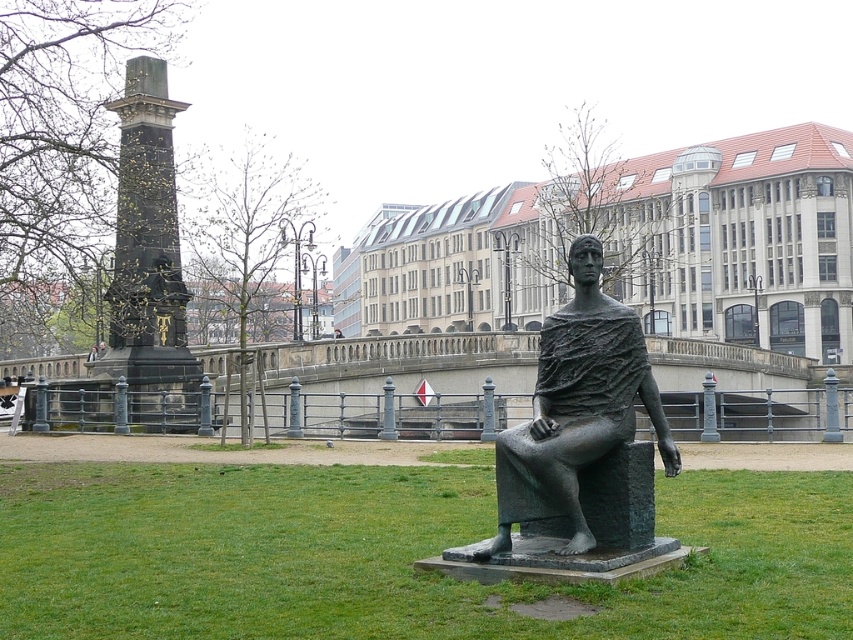
You are standing at the point with coordinates point [595,448] in the park. There is another point at point [171,538]. Which point is closer to you?

Point [595,448] is closer to you because it is the point you are standing at.

You are a gardener who needs to mow the green grass at lower center. Can you mow it without hitting the dark brown stone column at left?

The green grass at lower center has a lesser height compared to dark brown stone column at left, so yes, you can mow the green grass at lower center without hitting the dark brown stone column at left since it is shorter.